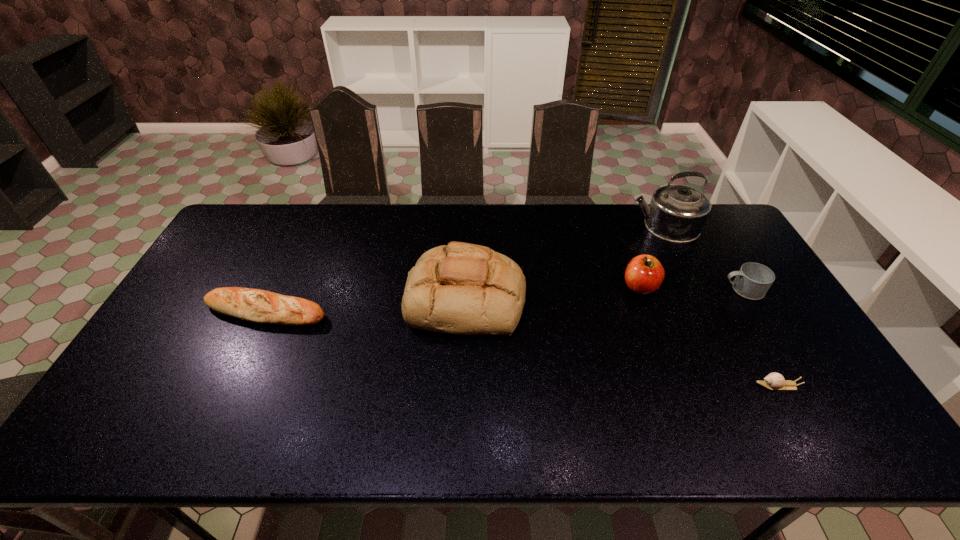
Image resolution: width=960 pixels, height=540 pixels. Find the location of `vacant space located 0.160m with the spout at the front of the tallest object`. vacant space located 0.160m with the spout at the front of the tallest object is located at coordinates (583, 226).

Where is `free location located with the spout at the front of the tallest object`? This screenshot has height=540, width=960. free location located with the spout at the front of the tallest object is located at coordinates (527, 226).

Identify the location of vacant position located 0.120m on the front of the fifth shortest object. (464, 379).

The height and width of the screenshot is (540, 960). I want to click on vacant area situated on the right of the apple, so click(717, 287).

This screenshot has width=960, height=540. Find the location of `vacant position located 0.250m on the side of the mug with the handle`. vacant position located 0.250m on the side of the mug with the handle is located at coordinates (640, 289).

Image resolution: width=960 pixels, height=540 pixels. In order to click on vacant space located on the side of the mug with the handle in this screenshot , I will do `click(683, 289)`.

The height and width of the screenshot is (540, 960). Identify the location of vacant area situated on the side of the mug with the handle. (640, 289).

Image resolution: width=960 pixels, height=540 pixels. Find the location of `vacant space located 0.050m on the front of the leftmost object`. vacant space located 0.050m on the front of the leftmost object is located at coordinates (251, 344).

Locate an element on the screen. vacant region located 0.270m on the shell of the escargot is located at coordinates (650, 386).

Find the location of a particular element. The width and height of the screenshot is (960, 540). vacant region located on the shell of the escargot is located at coordinates (637, 386).